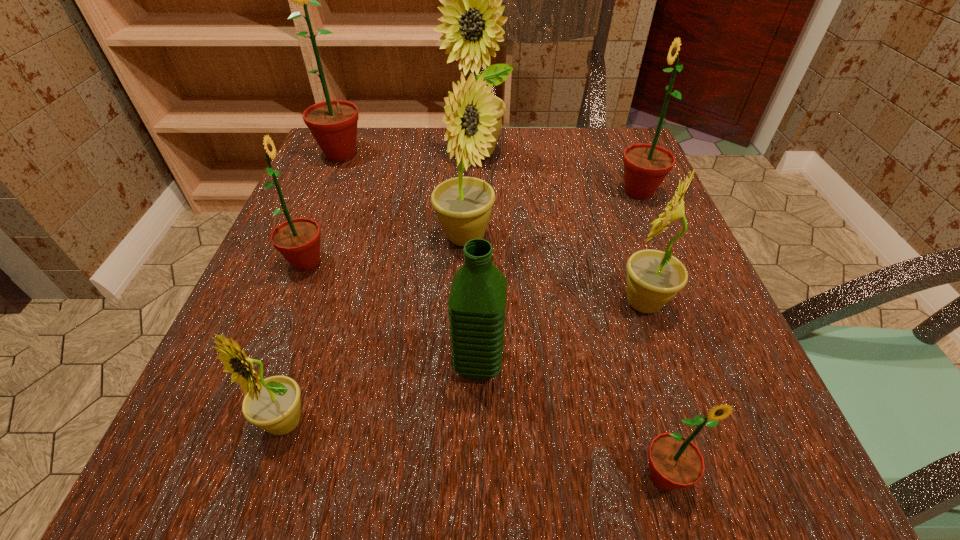
Locate an element on the screen. free space between the seventh farthest object and the fourth nearest object is located at coordinates (561, 333).

Locate an element on the screen. The width and height of the screenshot is (960, 540). free space between the biggest green sunflower and the nearest yellow sunflower is located at coordinates (313, 288).

The width and height of the screenshot is (960, 540). What are the coordinates of `vacant area that lies between the rightmost yellow sunflower and the farthest green sunflower` in the screenshot? It's located at (492, 228).

Where is `free space that is in between the second biggest yellow sunflower and the third farthest green sunflower`? free space that is in between the second biggest yellow sunflower and the third farthest green sunflower is located at coordinates (386, 251).

Locate an element on the screen. The height and width of the screenshot is (540, 960). vacant area that lies between the rightmost green sunflower and the nearest sunflower is located at coordinates (651, 334).

Where is `free space that is in between the third nearest object and the third biggest green sunflower`? This screenshot has width=960, height=540. free space that is in between the third nearest object and the third biggest green sunflower is located at coordinates (393, 313).

Locate an element on the screen. the third closest object to the third biggest yellow sunflower is located at coordinates (463, 204).

Where is `the closest object relative to the third farthest green sunflower`? The width and height of the screenshot is (960, 540). the closest object relative to the third farthest green sunflower is located at coordinates (463, 204).

Locate which sunflower is the closest to the third farthest object. Please provide its 2D coordinates. Your answer should be formatted as a tuple, i.e. [(x, y)], where the tuple contains the x and y coordinates of a point satisfying the conditions above.

[(654, 277)]

The image size is (960, 540). What are the coordinates of `sunflower that is the fifth closest to the third farthest green sunflower` in the screenshot? It's located at point(654,277).